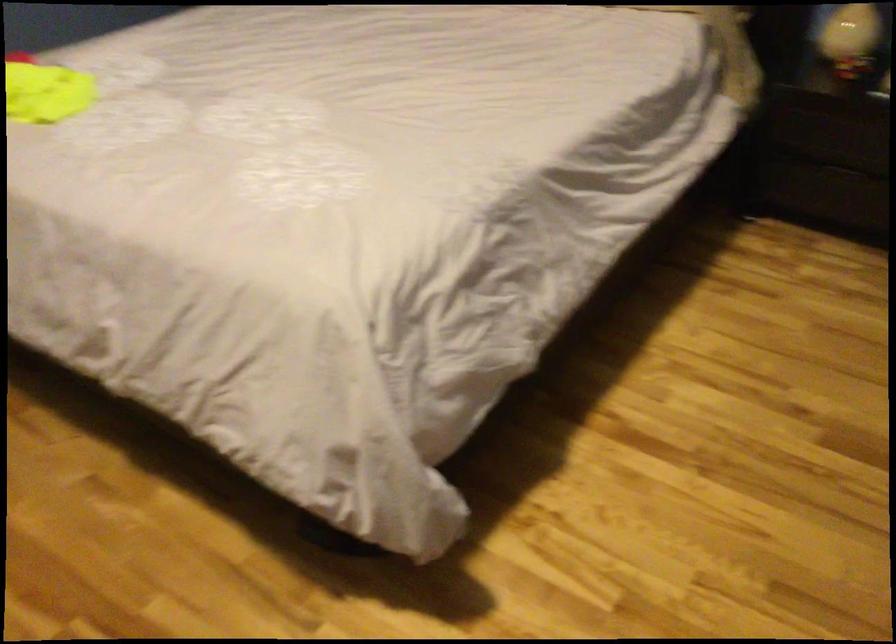
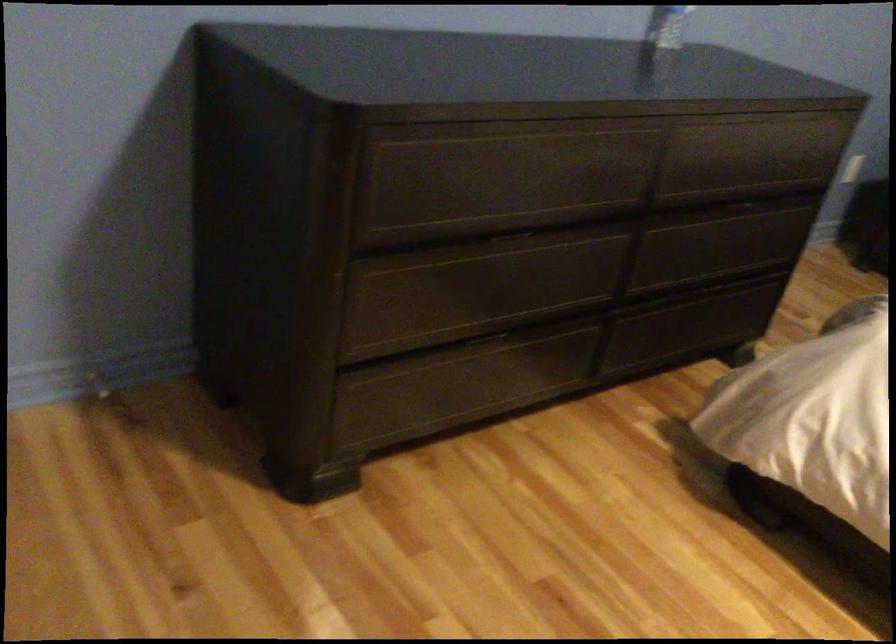
Question: In a continuous first-person perspective shot, in which direction is the camera moving?

Choices:
 (A) Left
 (B) Right
 (C) Forward
 (D) Backward

Answer: (A)